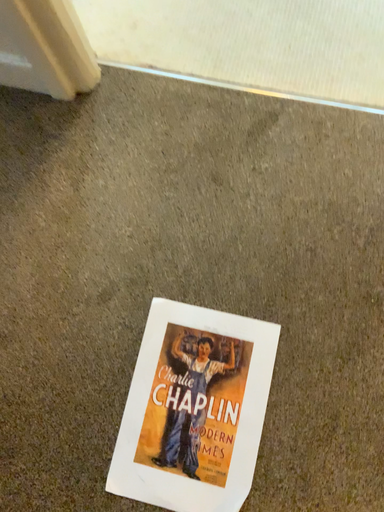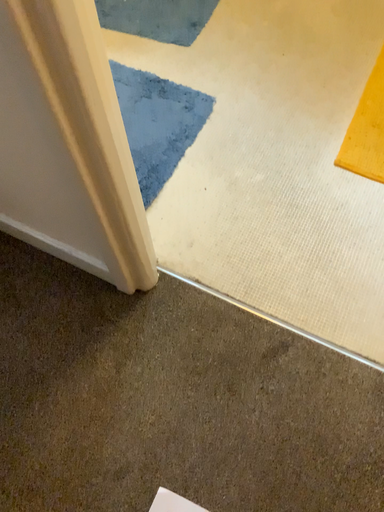
Question: Which way did the camera rotate in the video?

Choices:
 (A) rotated upward
 (B) rotated downward

Answer: (A)